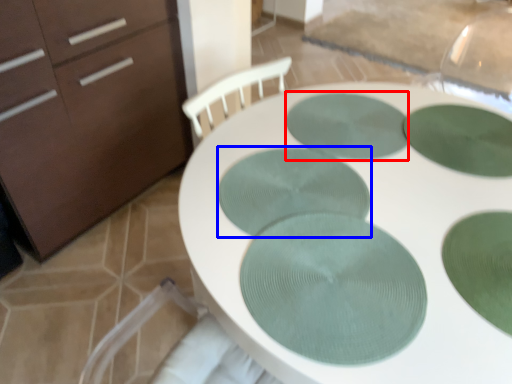
Question: Which object is further to the camera taking this photo, glass plate (highlighted by a red box) or glass plate (highlighted by a blue box)?

Choices:
 (A) glass plate
 (B) glass plate

Answer: (A)